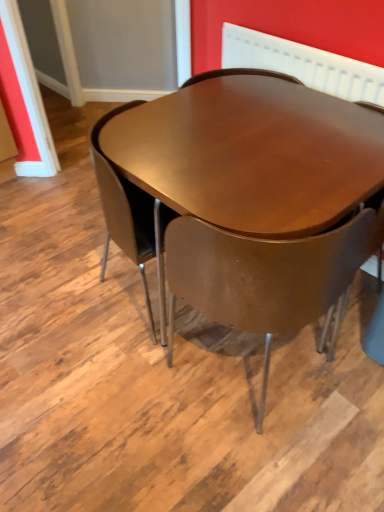
At what (x,y) coordinates should I click in order to perform the action: click on vacant space that is to the left of matte brown chair at center. Please return your answer as a coordinate pair (x, y). The height and width of the screenshot is (512, 384). Looking at the image, I should click on (141, 389).